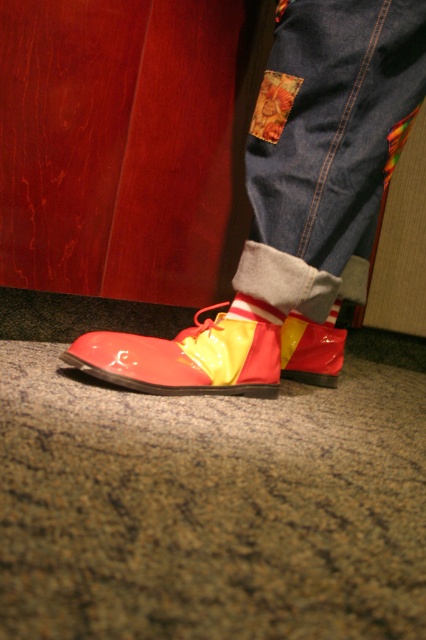
You are a fashion designer observing the image. You need to determine the spatial relationship between the glossy patent leather shoes at lower center and the yellow matte sock at lower center. Which object is positioned higher?

The glossy patent leather shoes at lower center are positioned above the yellow matte sock at lower center.

Based on the scene description, where is the glossy patent leather shoes at lower center located in terms of 2D coordinates?

The glossy patent leather shoes at lower center are located at the 2D coordinates of point (325, 141).